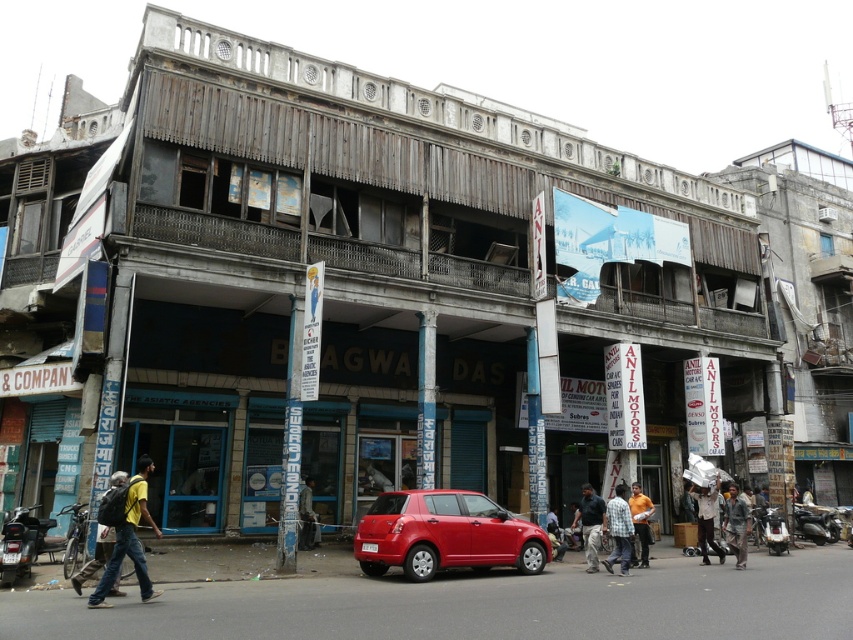
You are a delivery person who needs to place a package in the white matte plastic bag at center. You are currently holding the package and standing next to the denim jacket at lower right. Can you reach the bag without moving your feet?

The distance between the denim jacket at lower right and the white matte plastic bag at center is 63.00 centimeters. Since the average person can reach about 1 meter, you can reach the bag without moving your feet.

You are standing on the sidewalk in front of the multi story building. You want to walk to the shiny red hatchback at center. Which direction should you walk?

Walk towards the center of the image where the shiny red hatchback is located.

Looking at this image, you are standing on the street in front of the multi story building. You see a point at coordinate (735, 525). What object is located at that point?

The point at coordinate (735, 525) is located on the denim jacket at lower right.